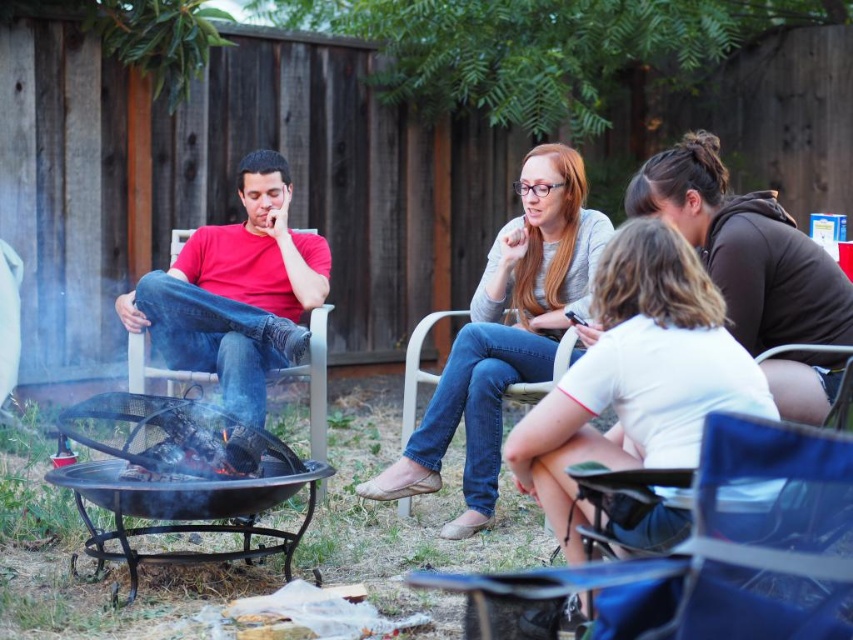
Does denim jeans at center have a lesser width compared to matte red shirt at center?

No, denim jeans at center is not thinner than matte red shirt at center.

Measure the distance between denim jeans at center and camera.

The distance of denim jeans at center from camera is 3.42 meters.

Image resolution: width=853 pixels, height=640 pixels. Identify the location of denim jeans at center. (505, 333).

From the picture: Is black wrought iron fire pit at lower left behind matte red shirt at center?

No, black wrought iron fire pit at lower left is in front of matte red shirt at center.

Does black wrought iron fire pit at lower left have a larger size compared to matte red shirt at center?

Yes, black wrought iron fire pit at lower left is bigger than matte red shirt at center.

What do you see at coordinates (178, 476) in the screenshot? The height and width of the screenshot is (640, 853). I see `black wrought iron fire pit at lower left` at bounding box center [178, 476].

Find the location of `black wrought iron fire pit at lower left`. black wrought iron fire pit at lower left is located at coordinates click(178, 476).

Between denim jeans at center and black wrought iron fire pit at lower left, which one appears on the right side from the viewer's perspective?

denim jeans at center

In the scene shown: Is denim jeans at center shorter than black wrought iron fire pit at lower left?

In fact, denim jeans at center may be taller than black wrought iron fire pit at lower left.

Is point (538, 170) positioned after point (148, 500)?

Yes, it is.

Locate an element on the screen. The width and height of the screenshot is (853, 640). denim jeans at center is located at coordinates (505, 333).